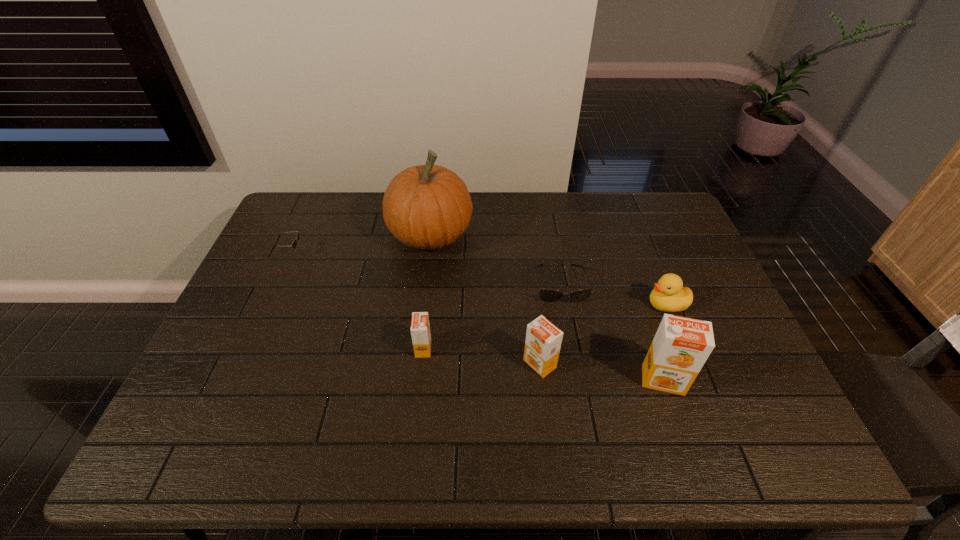
Please point out where to position a new orange juice on the left to maintain spacing. Please provide its 2D coordinates. Your answer should be formatted as a tuple, i.e. [(x, y)], where the tuple contains the x and y coordinates of a point satisfying the conditions above.

[(314, 334)]